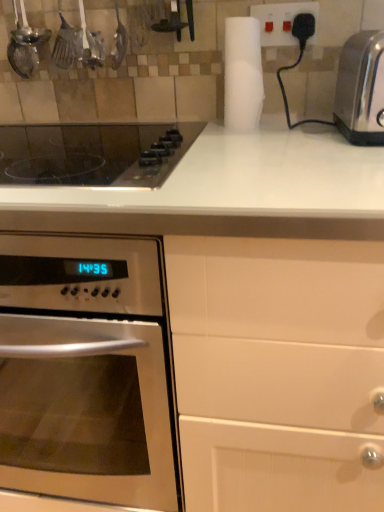
Question: Would you consider white matte paper towel at upper center to be distant from black glass cooktop at upper left?

Choices:
 (A) yes
 (B) no

Answer: (B)

Question: Can you confirm if white matte paper towel at upper center is wider than black glass cooktop at upper left?

Choices:
 (A) yes
 (B) no

Answer: (B)

Question: Is white matte paper towel at upper center turned away from black glass cooktop at upper left?

Choices:
 (A) no
 (B) yes

Answer: (A)

Question: Considering the relative sizes of white matte paper towel at upper center and black glass cooktop at upper left in the image provided, is white matte paper towel at upper center shorter than black glass cooktop at upper left?

Choices:
 (A) no
 (B) yes

Answer: (A)

Question: From the image's perspective, is white matte paper towel at upper center under black glass cooktop at upper left?

Choices:
 (A) yes
 (B) no

Answer: (B)

Question: Does white matte paper towel at upper center have a smaller size compared to black glass cooktop at upper left?

Choices:
 (A) yes
 (B) no

Answer: (A)

Question: Does satin silver oven at left have a larger size compared to white plastic plug at upper right?

Choices:
 (A) yes
 (B) no

Answer: (A)

Question: Does satin silver oven at left touch white plastic plug at upper right?

Choices:
 (A) yes
 (B) no

Answer: (B)

Question: Considering the relative positions of satin silver oven at left and white plastic plug at upper right in the image provided, is satin silver oven at left in front of white plastic plug at upper right?

Choices:
 (A) no
 (B) yes

Answer: (B)

Question: Is the position of satin silver oven at left more distant than that of white plastic plug at upper right?

Choices:
 (A) no
 (B) yes

Answer: (A)

Question: Is satin silver oven at left positioned beyond the bounds of white plastic plug at upper right?

Choices:
 (A) yes
 (B) no

Answer: (A)

Question: Is satin silver oven at left far from white plastic plug at upper right?

Choices:
 (A) no
 (B) yes

Answer: (A)

Question: Is satin silver toaster at right facing towards white matte paper towel at upper center?

Choices:
 (A) no
 (B) yes

Answer: (A)